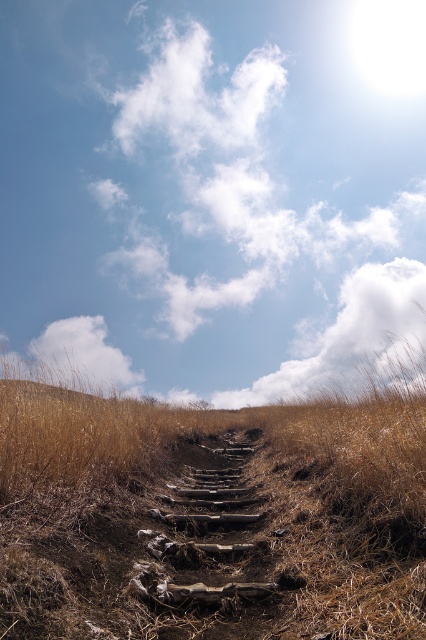
Looking at this image, you are standing on the rugged path and looking up at the blue sky at upper center and the brown dry grass at center. Which one appears taller from your perspective?

The blue sky at upper center appears taller than the brown dry grass at center because it is much taller as described.

You are standing on the rugged path and looking towards the brown dry grass at center. Which direction should you turn to see the blue sky at upper center?

The blue sky at upper center is to the left of the brown dry grass at center, so you should turn to your left to see it.